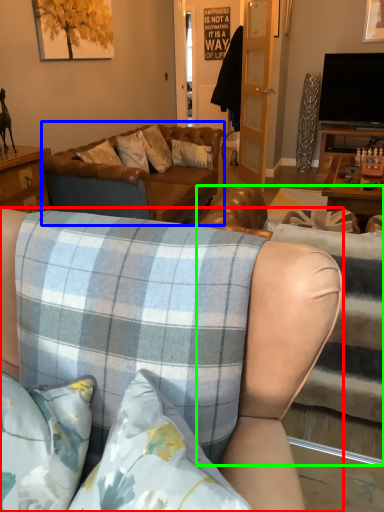
Question: Which is nearer to the studio couch (highlighted by a red box)? studio couch (highlighted by a blue box) or studio couch (highlighted by a green box).

Choices:
 (A) studio couch
 (B) studio couch

Answer: (B)